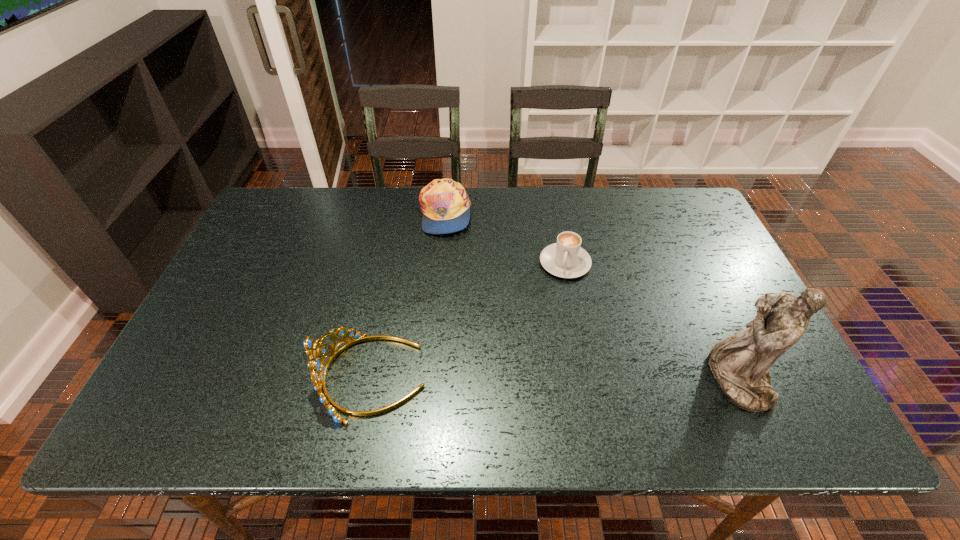
Identify the location of free location located on the front-facing side of the tallest object. (647, 379).

Locate an element on the screen. This screenshot has width=960, height=540. vacant space located on the front-facing side of the tallest object is located at coordinates (660, 379).

Image resolution: width=960 pixels, height=540 pixels. In order to click on free spot located to the right of the cappuccino in this screenshot , I will do `click(548, 328)`.

At what (x,y) coordinates should I click in order to perform the action: click on vacant space situated 0.100m to the right of the cappuccino. Please return your answer as a coordinate pair (x, y). Looking at the image, I should click on (554, 307).

Identify the location of free space located to the right of the cappuccino. (538, 368).

Locate an element on the screen. vacant position located 0.350m on the bill of the cap is located at coordinates (524, 309).

Locate an element on the screen. vacant space located on the bill of the cap is located at coordinates (487, 267).

You are a GUI agent. You are given a task and a screenshot of the screen. Output one action in this format:
    pyautogui.click(x=<x>, y=<y>)
    Task: Click on the free space located on the bill of the cap
    
    Given the screenshot: What is the action you would take?
    pyautogui.click(x=536, y=323)

The image size is (960, 540). In order to click on object at the far edge in this screenshot , I will do `click(445, 204)`.

Where is `tiara positioned at the near edge`? Image resolution: width=960 pixels, height=540 pixels. tiara positioned at the near edge is located at coordinates (318, 370).